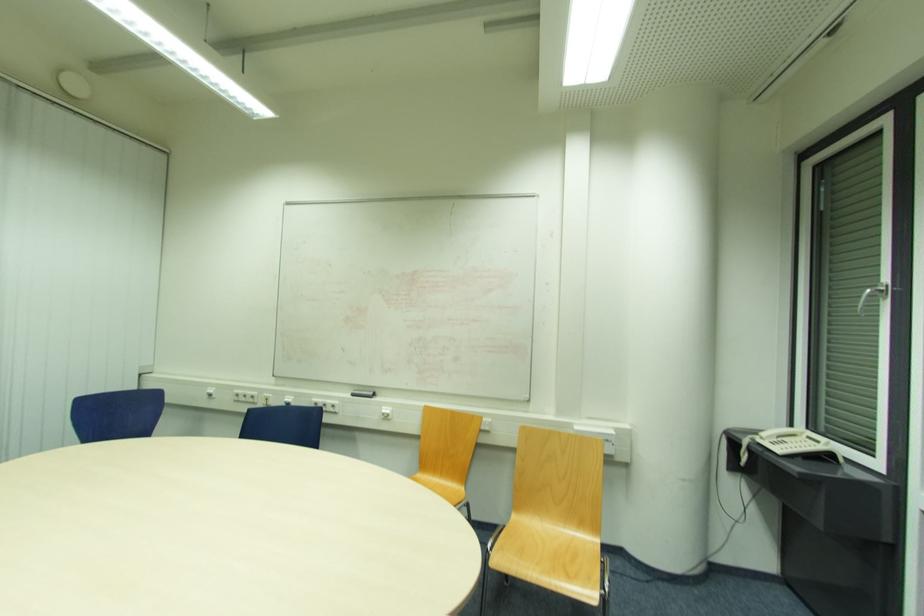
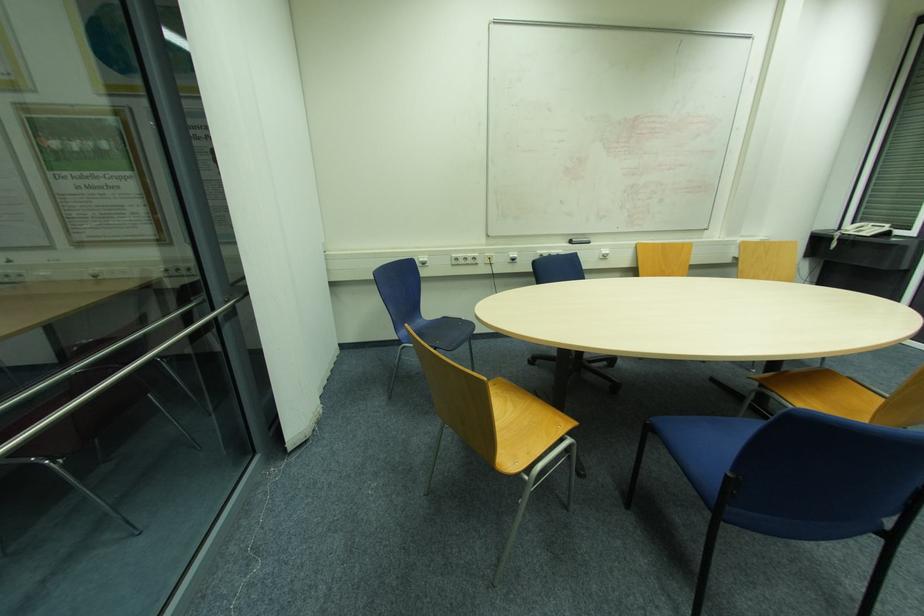
The point at (355, 395) is marked in the first image. Where is the corresponding point in the second image?

(574, 244)